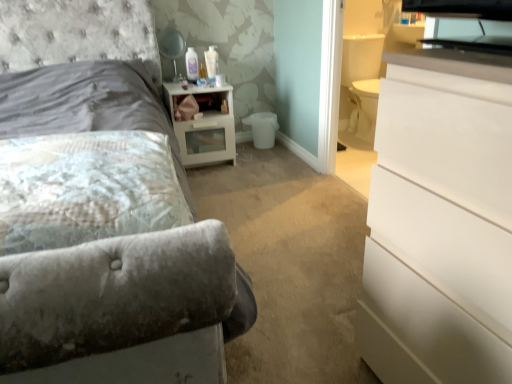
Question: Is point (110, 221) positioned closer to the camera than point (1, 71)?

Choices:
 (A) farther
 (B) closer

Answer: (B)

Question: Do you think fluffy white pillow at left is within velvet gray bed at upper left, or outside of it?

Choices:
 (A) inside
 (B) outside

Answer: (A)

Question: Estimate the real-world distances between objects in this image. Which object is farther from the fluffy white pillow at left?

Choices:
 (A) white glossy nightstand at center
 (B) white glossy chest of drawers at right
 (C) matte black lampshade at upper center
 (D) velvet gray bed at upper left

Answer: (C)

Question: Based on their relative distances, which object is nearer to the velvet gray bed at upper left?

Choices:
 (A) white glossy chest of drawers at right
 (B) fluffy white pillow at left
 (C) matte black lampshade at upper center
 (D) white glossy nightstand at center

Answer: (C)